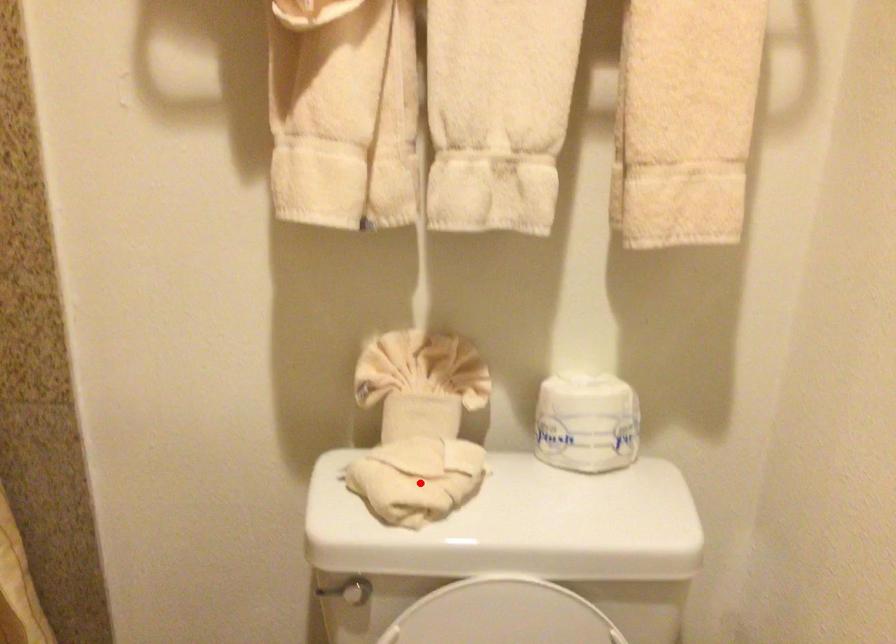
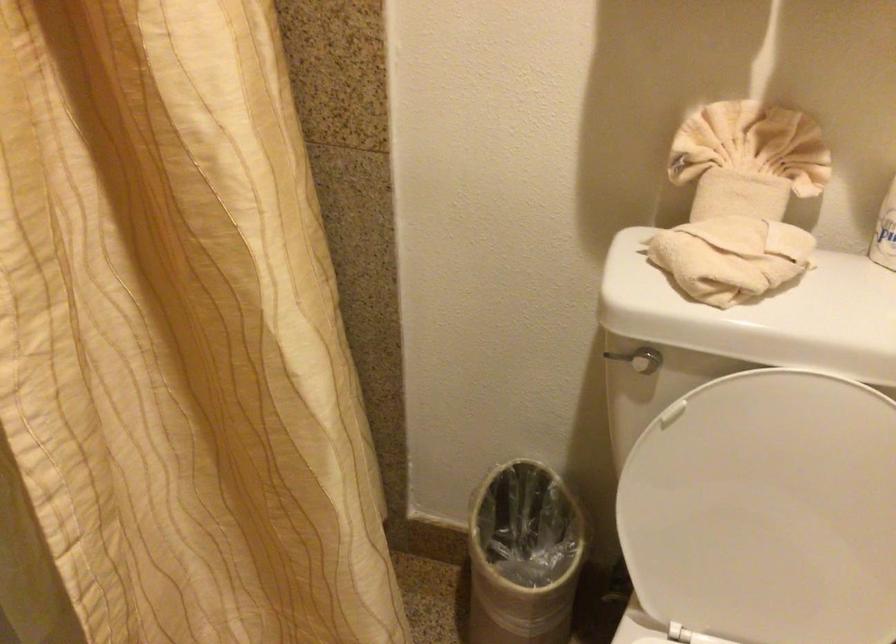
In the second image, find the point that corresponds to the highlighted location in the first image.

(730, 257)